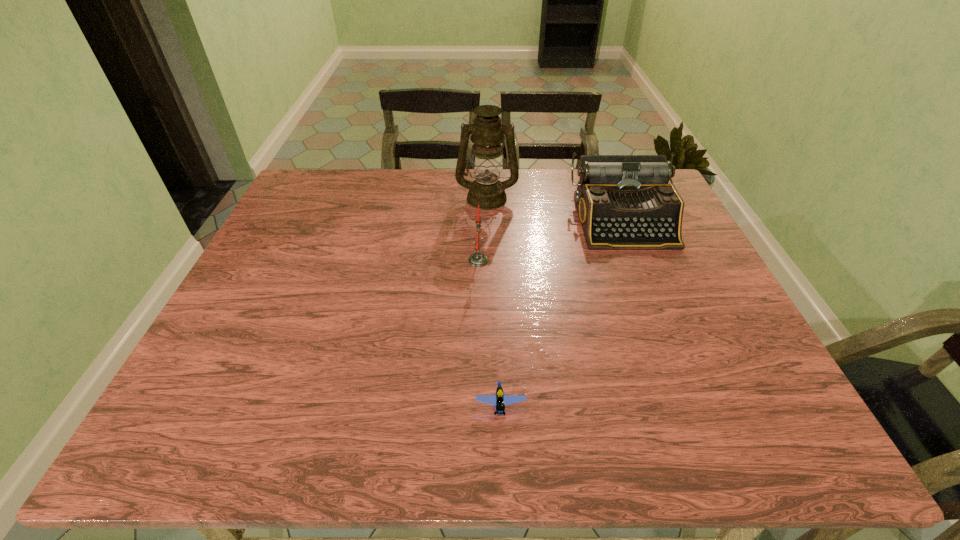
I want to click on object that is at the near edge, so click(x=499, y=400).

Identify the location of object that is positioned at the right edge. The height and width of the screenshot is (540, 960). (624, 202).

I want to click on object situated at the far right corner, so click(x=624, y=202).

Identify the location of free space at the far edge. Image resolution: width=960 pixels, height=540 pixels. (356, 176).

In the image, there is a desktop. Where is `vacant space at the near edge`? vacant space at the near edge is located at coordinates (472, 412).

You are a GUI agent. You are given a task and a screenshot of the screen. Output one action in this format:
    pyautogui.click(x=<x>, y=<y>)
    Task: Click on the vacant area at the right edge
    
    Given the screenshot: What is the action you would take?
    pyautogui.click(x=720, y=388)

Where is `vacant space at the far left corner of the desktop`? vacant space at the far left corner of the desktop is located at coordinates (340, 201).

Where is `vacant point located between the typewriter and the tallest object`? This screenshot has height=540, width=960. vacant point located between the typewriter and the tallest object is located at coordinates (555, 210).

The image size is (960, 540). Find the location of `vacant area that lies between the candle and the tallest object`. vacant area that lies between the candle and the tallest object is located at coordinates (483, 229).

I want to click on free space between the typewriter and the nearest object, so click(x=563, y=314).